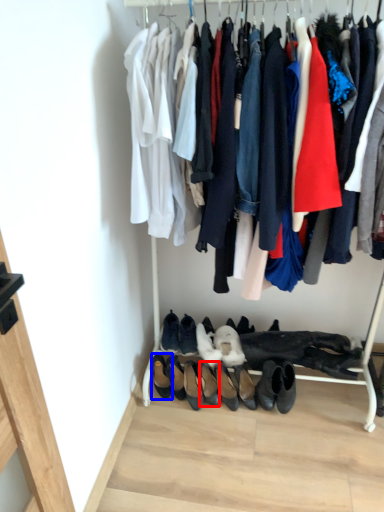
Question: Among these objects, which one is nearest to the camera, footwear (highlighted by a red box) or footwear (highlighted by a blue box)?

Choices:
 (A) footwear
 (B) footwear

Answer: (A)